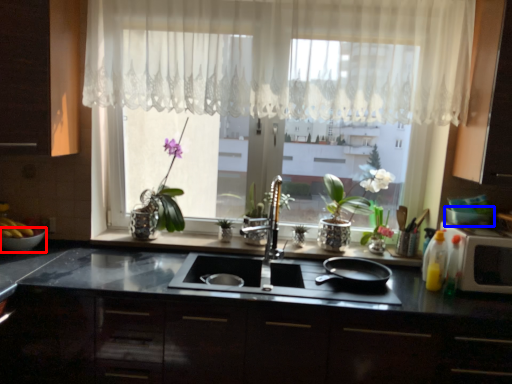
Question: Which point is closer to the camera, glass bowl (highlighted by a red box) or glass bowl (highlighted by a blue box)?

Choices:
 (A) glass bowl
 (B) glass bowl

Answer: (B)